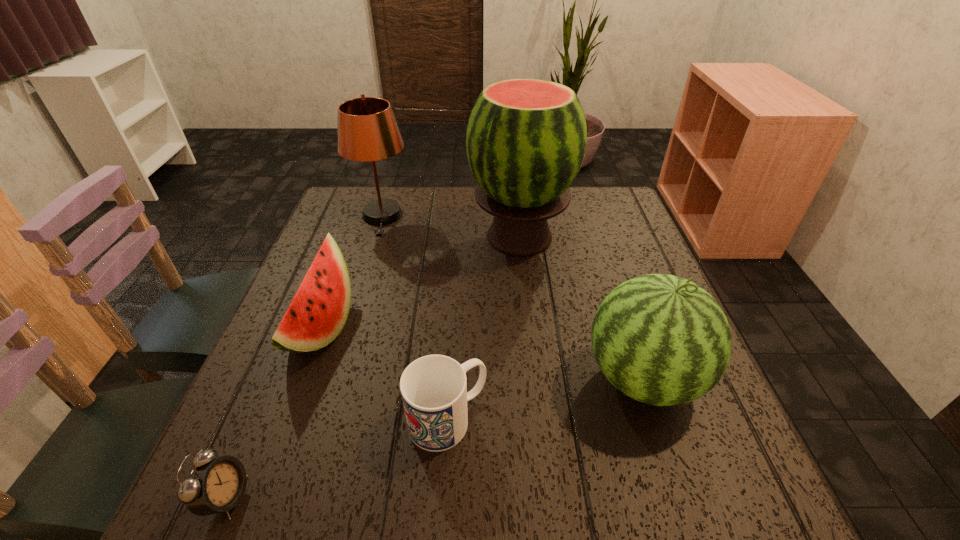
Locate an element on the screen. object present at the right edge is located at coordinates (660, 339).

This screenshot has height=540, width=960. I want to click on object present at the far left corner, so click(x=367, y=130).

You are a GUI agent. You are given a task and a screenshot of the screen. Output one action in this format:
    pyautogui.click(x=<x>, y=<y>)
    Task: Click on the object present at the near left corner
    The image size is (960, 540).
    Given the screenshot: What is the action you would take?
    pyautogui.click(x=214, y=485)

Find the location of a particular element. Image resolution: width=960 pixels, height=540 pixels. vacant space at the far edge of the desktop is located at coordinates (481, 211).

Image resolution: width=960 pixels, height=540 pixels. I want to click on vacant space at the near edge, so click(x=613, y=490).

This screenshot has width=960, height=540. Identify the location of free region at the left edge of the desktop. (372, 245).

Identify the location of blank area at the far left corner. The image size is (960, 540). (353, 197).

The width and height of the screenshot is (960, 540). I want to click on free region at the far right corner, so click(612, 198).

You are a GUI agent. You are given a task and a screenshot of the screen. Output one action in this format:
    pyautogui.click(x=<x>, y=<y>)
    Task: Click on the free space at the near right corner of the desktop
    
    Given the screenshot: What is the action you would take?
    point(662,472)

Identify the location of vacant region between the fourth shortest object and the fifth tallest object. (545, 399).